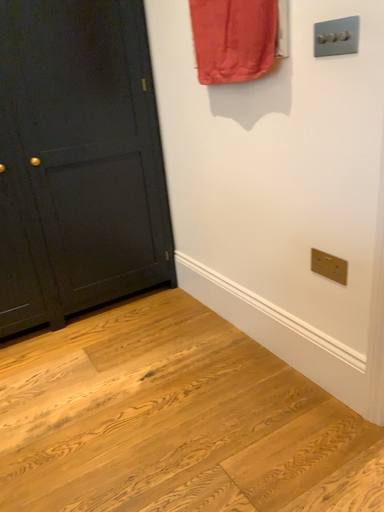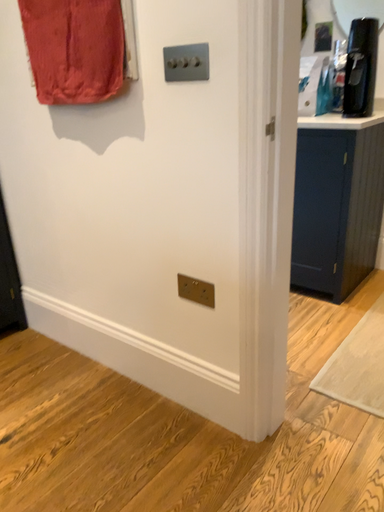
Question: Which way did the camera rotate in the video?

Choices:
 (A) rotated right
 (B) rotated left

Answer: (A)